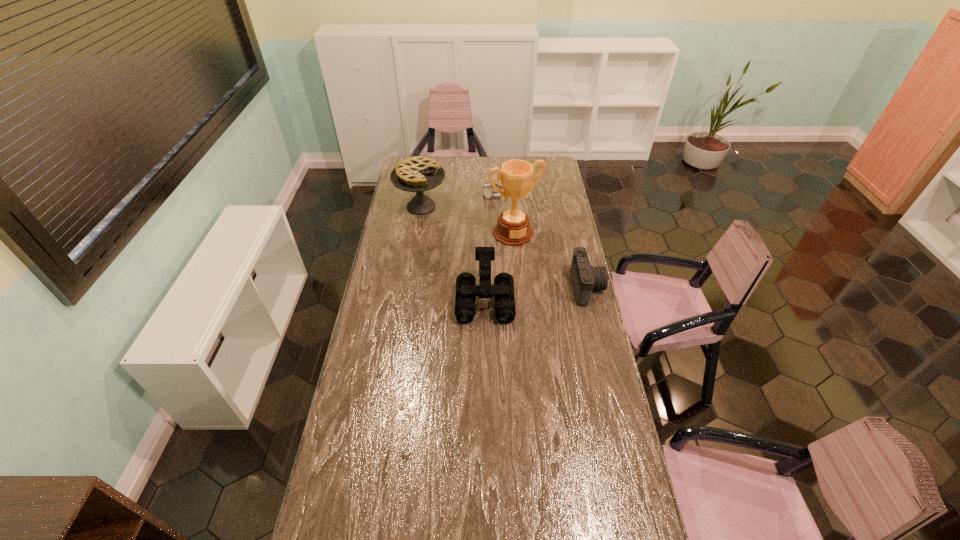
Locate an element on the screen. free space on the desktop that is between the binoculars and the fourth tallest object and is positioned on the face of the watch is located at coordinates (533, 294).

The width and height of the screenshot is (960, 540). I want to click on vacant space on the desktop that is between the third shortest object and the camera and is positioned on the cut side of the leftmost object, so click(x=534, y=294).

Where is `vacant space on the desktop that is between the third shortest object and the camera and is positioned on the front-facing side of the tallest object`? The height and width of the screenshot is (540, 960). vacant space on the desktop that is between the third shortest object and the camera and is positioned on the front-facing side of the tallest object is located at coordinates (545, 292).